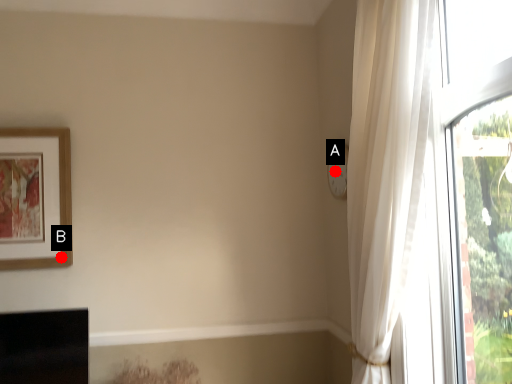
Question: Two points are circled on the image, labeled by A and B beside each circle. Which point is closer to the camera?

Choices:
 (A) A is closer
 (B) B is closer

Answer: (B)